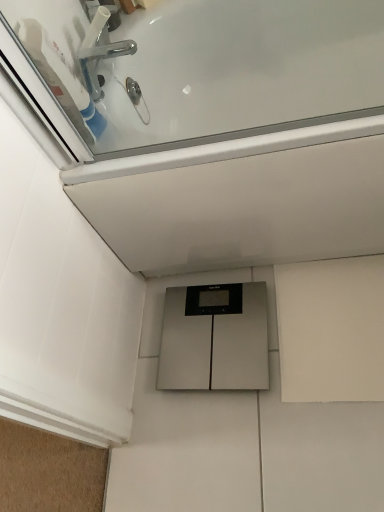
Question: Is there a large distance between white glossy bathtub at upper center and silver metallic scale at center?

Choices:
 (A) yes
 (B) no

Answer: (B)

Question: Can you confirm if white glossy bathtub at upper center is shorter than silver metallic scale at center?

Choices:
 (A) no
 (B) yes

Answer: (A)

Question: Is white glossy bathtub at upper center outside of silver metallic scale at center?

Choices:
 (A) yes
 (B) no

Answer: (A)

Question: Is white glossy bathtub at upper center thinner than silver metallic scale at center?

Choices:
 (A) no
 (B) yes

Answer: (A)

Question: Considering the relative positions of white glossy bathtub at upper center and silver metallic scale at center in the image provided, is white glossy bathtub at upper center behind silver metallic scale at center?

Choices:
 (A) no
 (B) yes

Answer: (A)

Question: Is silver metallic scale at center in front of or behind white glossy bathtub at upper center in the image?

Choices:
 (A) behind
 (B) front

Answer: (A)

Question: Would you say silver metallic scale at center is to the left or to the right of white glossy bathtub at upper center in the picture?

Choices:
 (A) right
 (B) left

Answer: (B)

Question: Is silver metallic scale at center bigger or smaller than white glossy bathtub at upper center?

Choices:
 (A) small
 (B) big

Answer: (A)

Question: Is silver metallic scale at center situated inside white glossy bathtub at upper center or outside?

Choices:
 (A) inside
 (B) outside

Answer: (B)

Question: Relative to chrome metallic faucet at upper left, is white glossy bathtub at upper center in front or behind?

Choices:
 (A) front
 (B) behind

Answer: (A)

Question: Is white glossy bathtub at upper center bigger or smaller than chrome metallic faucet at upper left?

Choices:
 (A) big
 (B) small

Answer: (A)

Question: Looking at their shapes, would you say white glossy bathtub at upper center is wider or thinner than chrome metallic faucet at upper left?

Choices:
 (A) wide
 (B) thin

Answer: (A)

Question: From the image's perspective, is white glossy bathtub at upper center located above or below chrome metallic faucet at upper left?

Choices:
 (A) above
 (B) below

Answer: (B)

Question: Considering their positions, is chrome metallic faucet at upper left located in front of or behind white glossy bathtub at upper center?

Choices:
 (A) front
 (B) behind

Answer: (B)

Question: Visually, is chrome metallic faucet at upper left positioned to the left or to the right of white glossy bathtub at upper center?

Choices:
 (A) right
 (B) left

Answer: (B)